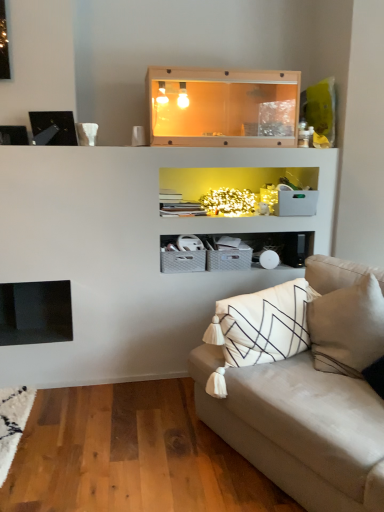
Question: From their relative heights in the image, would you say wooden tank at upper center is taller or shorter than beige fabric couch at lower right?

Choices:
 (A) short
 (B) tall

Answer: (A)

Question: From a real-world perspective, relative to beige fabric couch at lower right, is wooden tank at upper center vertically above or below?

Choices:
 (A) below
 (B) above

Answer: (B)

Question: From the image's perspective, relative to beige fabric couch at lower right, is wooden tank at upper center above or below?

Choices:
 (A) below
 (B) above

Answer: (B)

Question: In terms of height, does beige fabric couch at lower right look taller or shorter compared to wooden tank at upper center?

Choices:
 (A) tall
 (B) short

Answer: (A)

Question: In the image, is beige fabric couch at lower right on the left side or the right side of wooden tank at upper center?

Choices:
 (A) right
 (B) left

Answer: (A)

Question: Considering their positions, is beige fabric couch at lower right located in front of or behind wooden tank at upper center?

Choices:
 (A) behind
 (B) front

Answer: (B)

Question: From the image's perspective, is beige fabric couch at lower right located above or below wooden tank at upper center?

Choices:
 (A) below
 (B) above

Answer: (A)